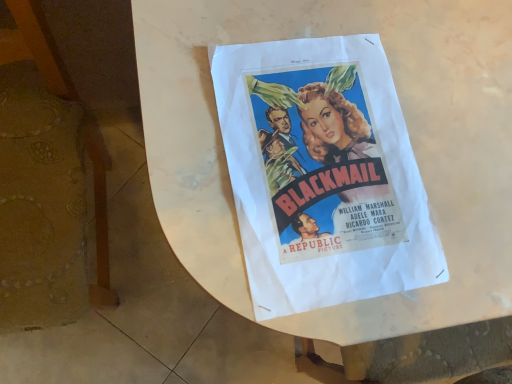
Image resolution: width=512 pixels, height=384 pixels. Find the location of `vacant space to the right of matte paper poster at center`. vacant space to the right of matte paper poster at center is located at coordinates tap(457, 223).